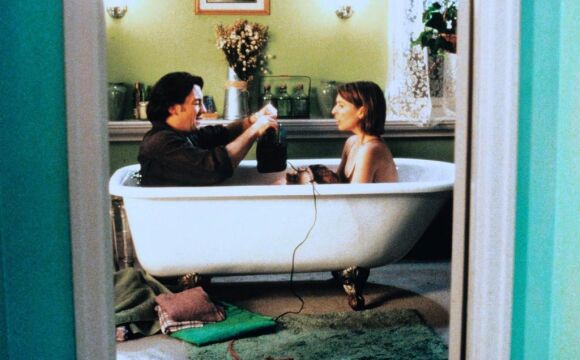
Find the location of a particular element. The width and height of the screenshot is (580, 360). claw toed bathrub is located at coordinates (270, 230).